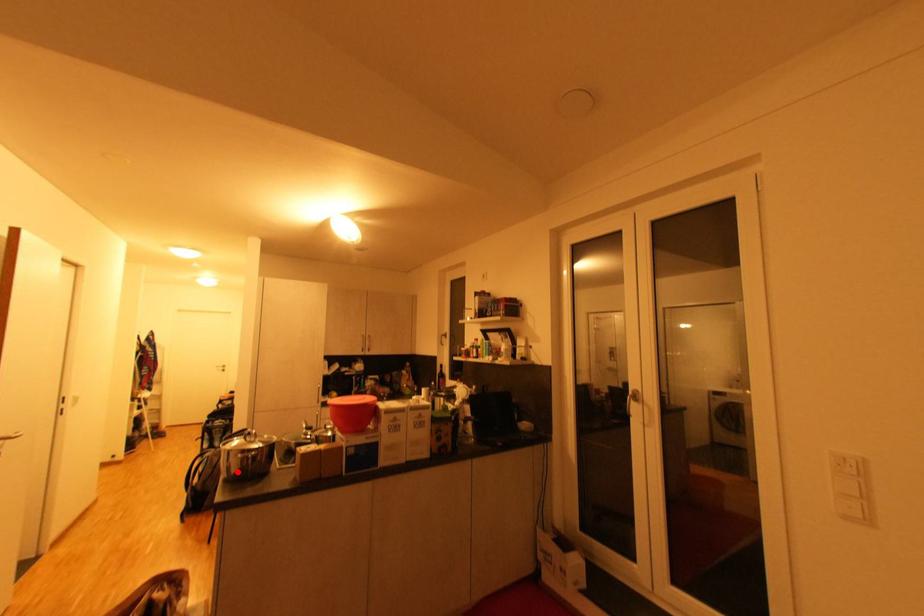
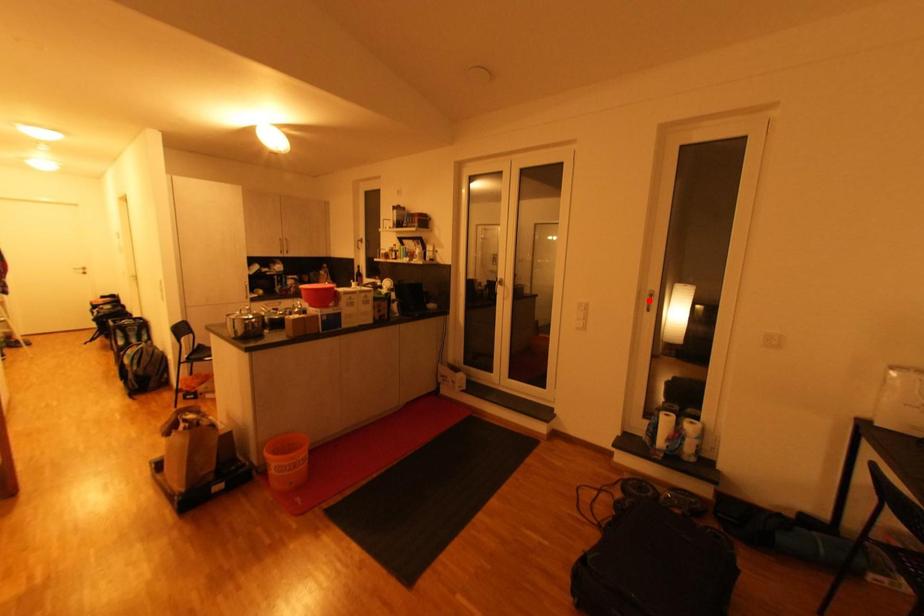
I am providing you with two images of the same scene from different viewpoints. A red point is marked on the first image and another point is marked on the second image. Is the marked point in image1 the same physical position as the marked point in image2?

No